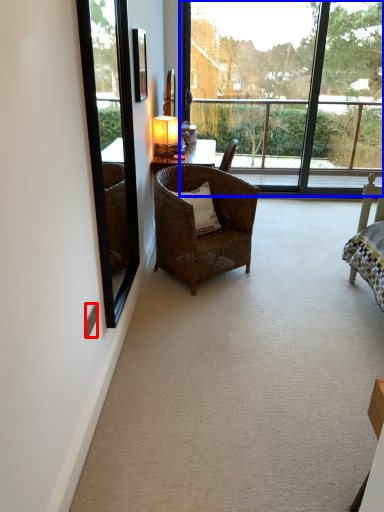
Question: Which point is closer to the camera, power outlet (highlighted by a red box) or window (highlighted by a blue box)?

Choices:
 (A) power outlet
 (B) window

Answer: (A)